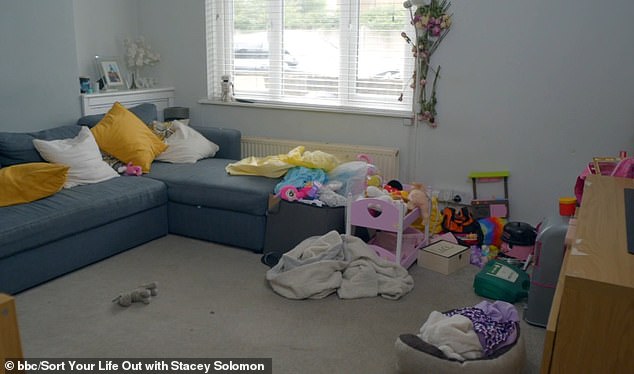
This screenshot has width=634, height=374. Find the location of `stuffed animal plush`. stuffed animal plush is located at coordinates (x=138, y=292).